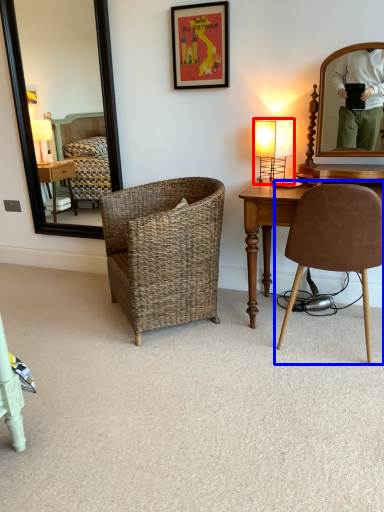
Question: Among these objects, which one is nearest to the camera, lamp (highlighted by a red box) or chair (highlighted by a blue box)?

Choices:
 (A) lamp
 (B) chair

Answer: (B)